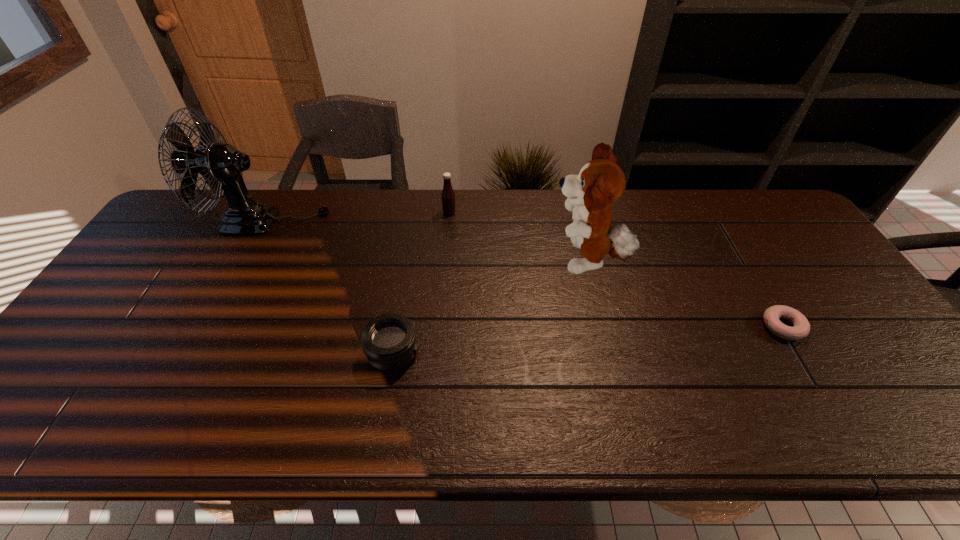
I want to click on unoccupied area between the Tabasco sauce and the telephoto lens, so click(x=421, y=283).

Locate an element on the screen. This screenshot has height=540, width=960. free space between the leftmost object and the doughnut is located at coordinates (525, 274).

This screenshot has height=540, width=960. In order to click on free point between the rightmost object and the puppy in this screenshot , I will do `click(684, 294)`.

Find the location of `free space between the doughnut and the leftmost object`. free space between the doughnut and the leftmost object is located at coordinates (525, 274).

Locate an element on the screen. The height and width of the screenshot is (540, 960). vacant space in between the puppy and the rightmost object is located at coordinates (684, 294).

Image resolution: width=960 pixels, height=540 pixels. What are the coordinates of `object that is the closest to the telephoto lens` in the screenshot? It's located at (221, 165).

Image resolution: width=960 pixels, height=540 pixels. I want to click on the third closest object to the telephoto lens, so click(448, 197).

Where is `vacant space that satisfies the following two spatial constraints: 1. in front of the fan, indicating the direction of air flow; 2. on the back side of the rightmost object`? Image resolution: width=960 pixels, height=540 pixels. vacant space that satisfies the following two spatial constraints: 1. in front of the fan, indicating the direction of air flow; 2. on the back side of the rightmost object is located at coordinates (212, 327).

Identify the location of free space that satisfies the following two spatial constraints: 1. on the front side of the Tabasco sauce; 2. on the side of the fourth tallest object with brand markings and control switches. (438, 353).